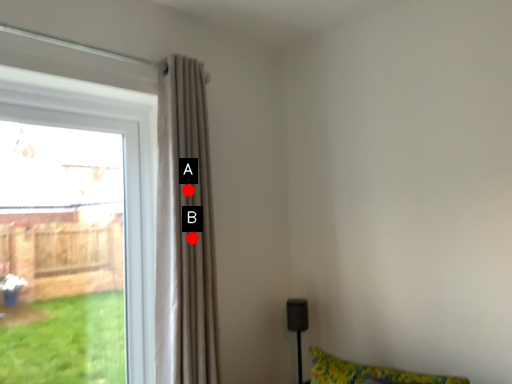
Question: Two points are circled on the image, labeled by A and B beside each circle. Which of the following is the closest to the observer?

Choices:
 (A) A is closer
 (B) B is closer

Answer: (B)